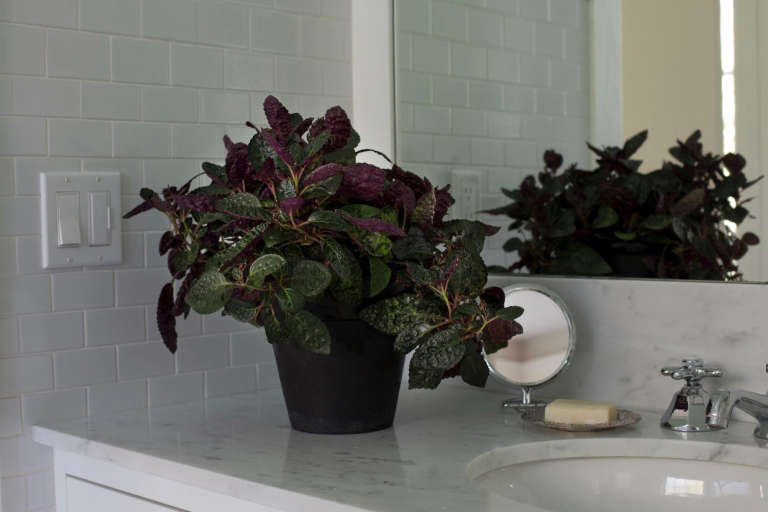
Identify the location of bar. The height and width of the screenshot is (512, 768). (110, 218).